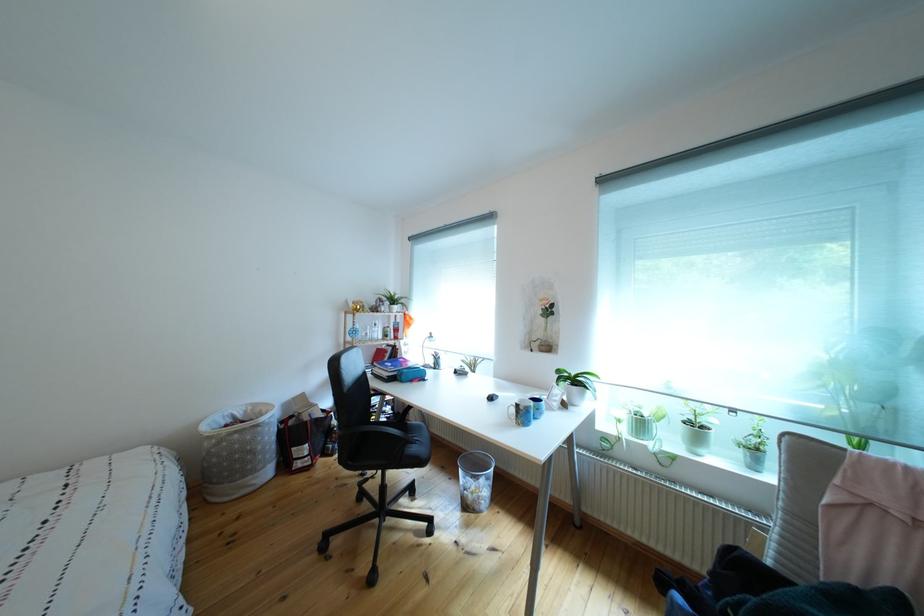
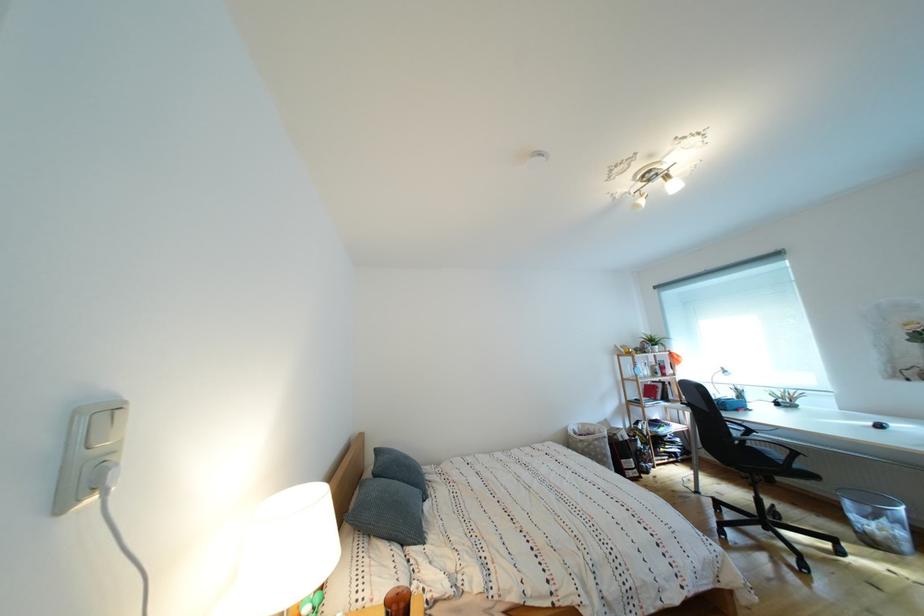
Where in the second image is the point corresponding to point (266, 411) from the first image?

(594, 430)